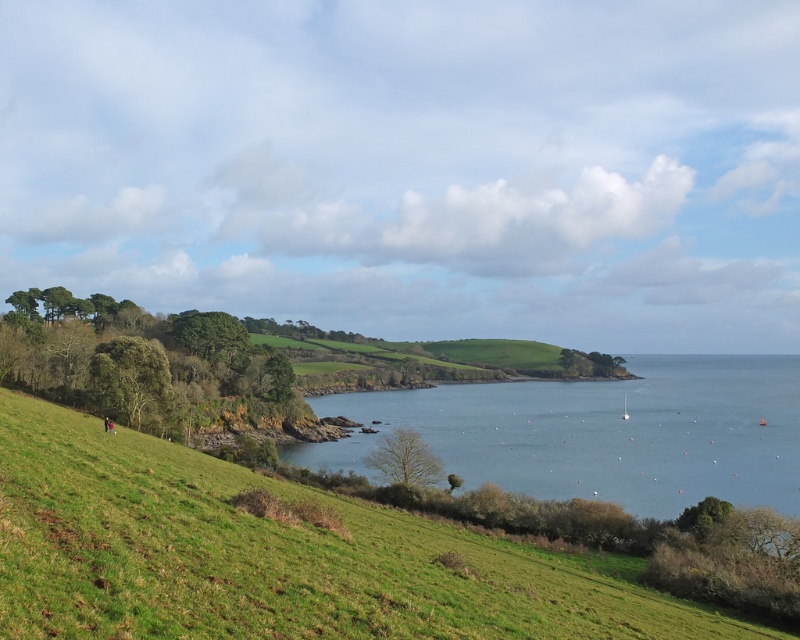
Question: Which point is farther to the camera?

Choices:
 (A) green grassy hillside at lower left
 (B) blue water at center

Answer: (B)

Question: Is green grassy hillside at lower left wider than blue water at center?

Choices:
 (A) yes
 (B) no

Answer: (B)

Question: Is green grassy hillside at lower left to the left of blue water at center from the viewer's perspective?

Choices:
 (A) no
 (B) yes

Answer: (B)

Question: Which point is farther to the camera?

Choices:
 (A) green grassy hillside at lower left
 (B) blue water at center

Answer: (B)

Question: Does green grassy hillside at lower left have a larger size compared to blue water at center?

Choices:
 (A) no
 (B) yes

Answer: (A)